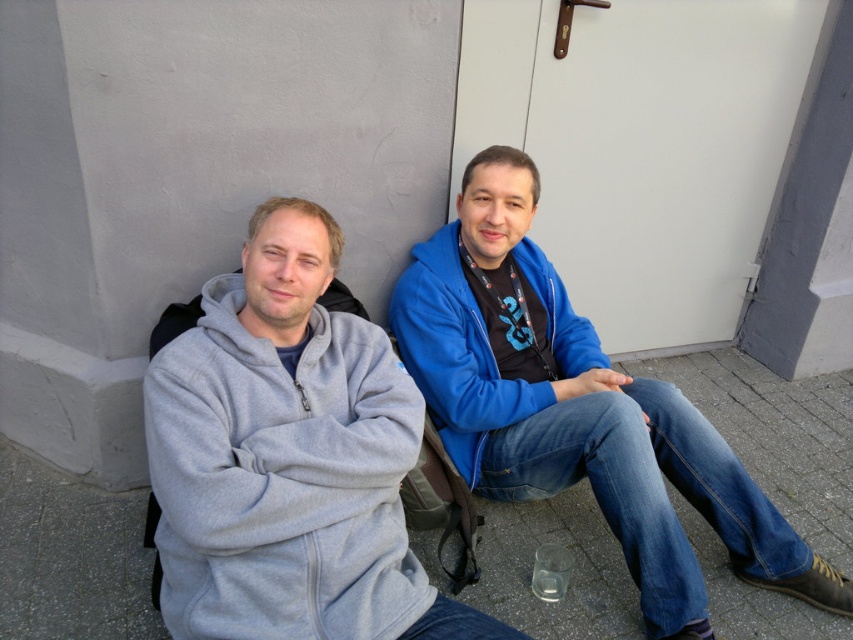
You are standing at the wall and want to place a small potted plant between the two points, point (225,410) and point (555,365). Which point should the plant be closer to in order to be in front of the other point?

The plant should be closer to point (225,410) because it is in front of point (555,365).

You are a photographer trying to capture both the gray fleece hoodie at left and the blue fleece jacket at center in a single frame. Based on their sizes, which clothing item would appear smaller in the photo?

The gray fleece hoodie at left appears smaller in the photo because it has a lesser width compared to the blue fleece jacket at center.

You are standing in front of the two people in the image. If you want to approach the gray fleece hoodie at left, which direction should you move relative to your current position?

Since the gray fleece hoodie at left is located at point 0.716 on the x axis and 0.339 on the y axis, you should move towards the left and slightly downward to reach it.